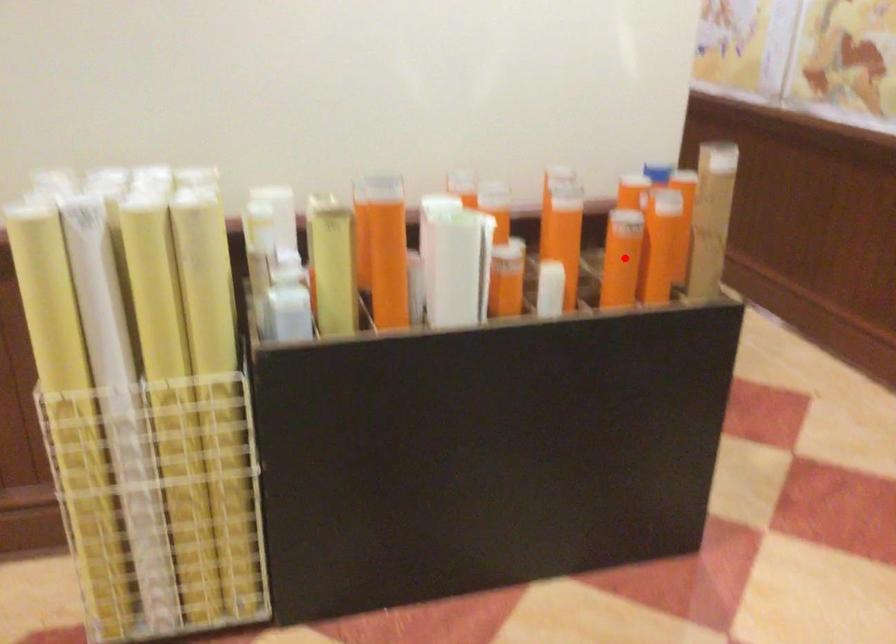
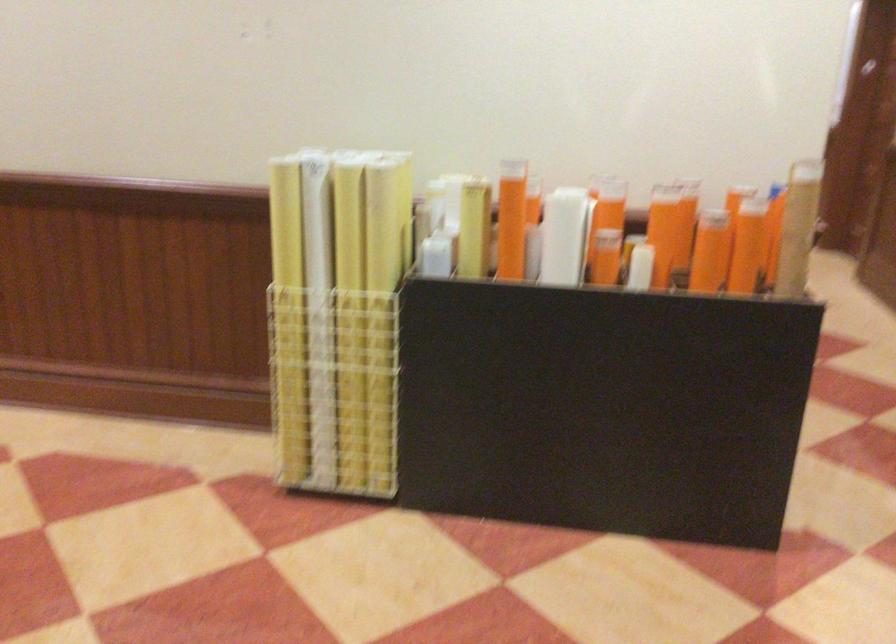
Question: I am providing you with two images of the same scene from different viewpoints. A red point is marked on the first image. At the location where the point appears in image 1, is it still visible in image 2?

Choices:
 (A) Yes
 (B) No

Answer: (A)